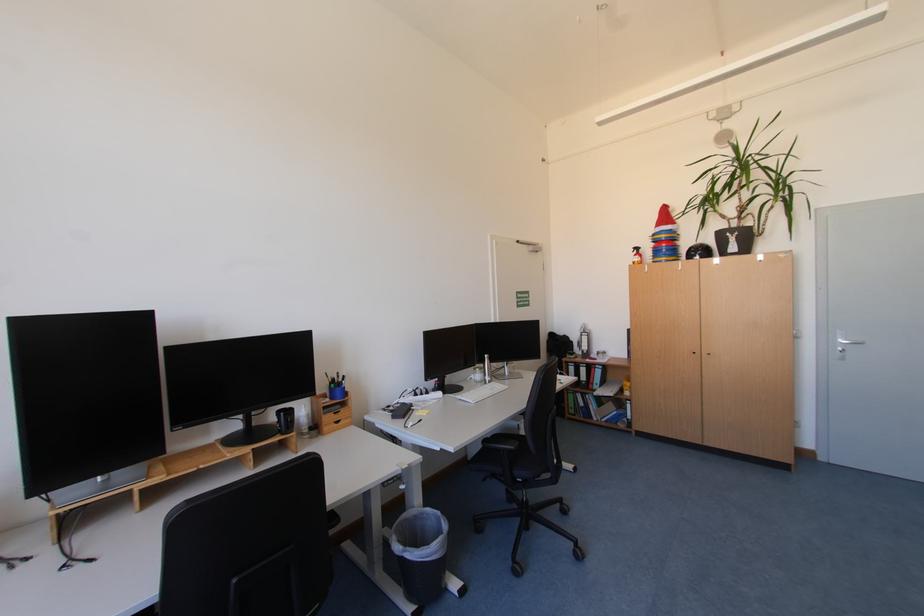
Find the location of `silver door handle`. silver door handle is located at coordinates (845, 342).